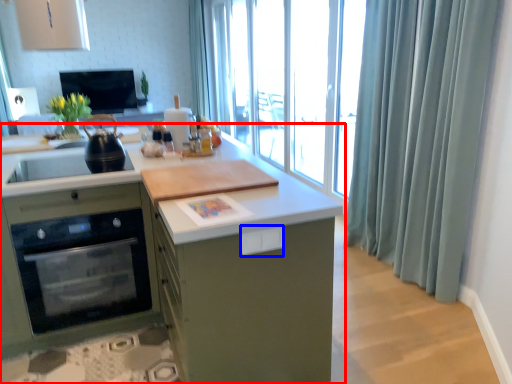
Question: Which point is closer to the camera, cabinetry (highlighted by a red box) or drawer (highlighted by a blue box)?

Choices:
 (A) cabinetry
 (B) drawer

Answer: (A)